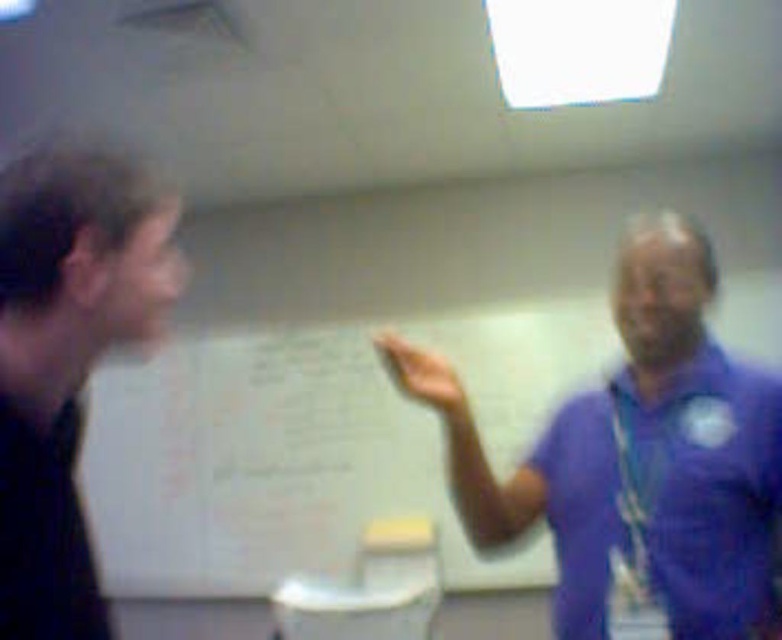
Is white matte bulletin board at center shorter than black matte shirt at left?

In fact, white matte bulletin board at center may be taller than black matte shirt at left.

Who is shorter, white matte bulletin board at center or black matte shirt at left?

With less height is black matte shirt at left.

Identify the location of white matte bulletin board at center. (264, 465).

Is point (676, 492) farther from viewer compared to point (16, 522)?

Yes, it is behind point (16, 522).

The image size is (782, 640). In order to click on purple matte shirt at center in this screenshot , I will do `click(637, 456)`.

You are a GUI agent. You are given a task and a screenshot of the screen. Output one action in this format:
    pyautogui.click(x=<x>, y=<y>)
    Task: Click on the purple matte shirt at center
    
    Given the screenshot: What is the action you would take?
    pyautogui.click(x=637, y=456)

Does white matte bulletin board at center appear over purple matte shirt at center?

No.

Which of these two, white matte bulletin board at center or purple matte shirt at center, stands shorter?

purple matte shirt at center is shorter.

Is point (379, 500) positioned after point (752, 566)?

Yes, point (379, 500) is farther from viewer.

Find the location of `white matte bulletin board at center`. white matte bulletin board at center is located at coordinates (264, 465).